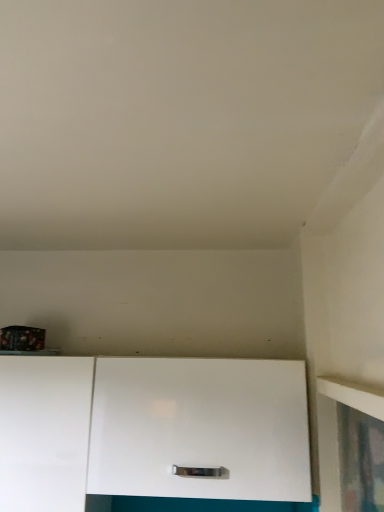
This screenshot has height=512, width=384. What do you see at coordinates (44, 432) in the screenshot? I see `white glossy cabinet at lower left, arranged as the first cabinetry when viewed from the left` at bounding box center [44, 432].

Image resolution: width=384 pixels, height=512 pixels. Find the location of `white glossy cabinet at lower left, arranged as the first cabinetry when viewed from the left`. white glossy cabinet at lower left, arranged as the first cabinetry when viewed from the left is located at coordinates (44, 432).

In order to face white glossy cabinet at lower left, the second cabinetry from the right, should I rotate leftwards or rightwards?

To face it directly, rotate left by 20.729 degrees.

What is the approximate width of white glossy cabinet at center, the 2th cabinetry from the left?

white glossy cabinet at center, the 2th cabinetry from the left, is 13.89 inches wide.

Describe the element at coordinates (152, 434) in the screenshot. I see `white glossy cabinet at center, the 2th cabinetry from the left` at that location.

Where is `white glossy cabinet at center, the 2th cabinetry from the left`? The image size is (384, 512). white glossy cabinet at center, the 2th cabinetry from the left is located at coordinates (152, 434).

This screenshot has height=512, width=384. What are the coordinates of `white glossy cabinet at lower left, the second cabinetry from the right` in the screenshot? It's located at (44, 432).

Considering the positions of objects white glossy cabinet at lower left, the second cabinetry from the right, and white glossy cabinet at center, placed as the 1th cabinetry when sorted from right to left, in the image provided, who is more to the left, white glossy cabinet at lower left, the second cabinetry from the right, or white glossy cabinet at center, placed as the 1th cabinetry when sorted from right to left,?

white glossy cabinet at lower left, the second cabinetry from the right.

Based on the photo, is the depth of white glossy cabinet at lower left, the second cabinetry from the right, greater than that of white glossy cabinet at center, the 2th cabinetry from the left?

Yes, white glossy cabinet at lower left, the second cabinetry from the right, is further from the viewer.

Considering the positions of points (58, 498) and (107, 384), is point (58, 498) farther from camera compared to point (107, 384)?

That is False.

From the image's perspective, between white glossy cabinet at lower left, arranged as the first cabinetry when viewed from the left, and white glossy cabinet at center, placed as the 1th cabinetry when sorted from right to left, which one is located above?

white glossy cabinet at center, placed as the 1th cabinetry when sorted from right to left, appears higher in the image.

From a real-world perspective, relative to white glossy cabinet at center, placed as the 1th cabinetry when sorted from right to left, is white glossy cabinet at lower left, the second cabinetry from the right, vertically above or below?

white glossy cabinet at lower left, the second cabinetry from the right, is situated lower than white glossy cabinet at center, placed as the 1th cabinetry when sorted from right to left, in the real world.

Between white glossy cabinet at lower left, arranged as the first cabinetry when viewed from the left, and white glossy cabinet at center, placed as the 1th cabinetry when sorted from right to left, which one has smaller width?

white glossy cabinet at lower left, arranged as the first cabinetry when viewed from the left.

From their relative heights in the image, would you say white glossy cabinet at lower left, arranged as the first cabinetry when viewed from the left, is taller or shorter than white glossy cabinet at center, the 2th cabinetry from the left?

Considering their sizes, white glossy cabinet at lower left, arranged as the first cabinetry when viewed from the left, has more height than white glossy cabinet at center, the 2th cabinetry from the left.

Can you confirm if white glossy cabinet at lower left, the second cabinetry from the right, is bigger than white glossy cabinet at center, placed as the 1th cabinetry when sorted from right to left?

Indeed, white glossy cabinet at lower left, the second cabinetry from the right, has a larger size compared to white glossy cabinet at center, placed as the 1th cabinetry when sorted from right to left.

Can we say white glossy cabinet at lower left, the second cabinetry from the right, lies outside white glossy cabinet at center, the 2th cabinetry from the left?

Yes.

Are white glossy cabinet at lower left, arranged as the first cabinetry when viewed from the left, and white glossy cabinet at center, placed as the 1th cabinetry when sorted from right to left, located far from each other?

No, there isn't a large distance between white glossy cabinet at lower left, arranged as the first cabinetry when viewed from the left, and white glossy cabinet at center, placed as the 1th cabinetry when sorted from right to left.

Does white glossy cabinet at lower left, the second cabinetry from the right, turn towards white glossy cabinet at center, placed as the 1th cabinetry when sorted from right to left?

No, white glossy cabinet at lower left, the second cabinetry from the right, is not oriented towards white glossy cabinet at center, placed as the 1th cabinetry when sorted from right to left.

How many degrees apart are the facing directions of white glossy cabinet at lower left, arranged as the first cabinetry when viewed from the left, and white glossy cabinet at center, placed as the 1th cabinetry when sorted from right to left?

The angular difference between white glossy cabinet at lower left, arranged as the first cabinetry when viewed from the left, and white glossy cabinet at center, placed as the 1th cabinetry when sorted from right to left, is 0.000278 degrees.

How much distance is there between white glossy cabinet at lower left, arranged as the first cabinetry when viewed from the left, and white glossy cabinet at center, the 2th cabinetry from the left?

white glossy cabinet at lower left, arranged as the first cabinetry when viewed from the left, is 10.37 centimeters away from white glossy cabinet at center, the 2th cabinetry from the left.

The image size is (384, 512). I want to click on cabinetry located above the white glossy cabinet at lower left, the second cabinetry from the right (from the image's perspective), so click(x=152, y=434).

Looking at this image, considering the relative positions of white glossy cabinet at center, the 2th cabinetry from the left, and white glossy cabinet at lower left, arranged as the first cabinetry when viewed from the left, in the image provided, is white glossy cabinet at center, the 2th cabinetry from the left, to the left or to the right of white glossy cabinet at lower left, arranged as the first cabinetry when viewed from the left,?

From the image, it's evident that white glossy cabinet at center, the 2th cabinetry from the left, is to the right of white glossy cabinet at lower left, arranged as the first cabinetry when viewed from the left.

Which object is more forward, white glossy cabinet at center, the 2th cabinetry from the left, or white glossy cabinet at lower left, the second cabinetry from the right?

white glossy cabinet at center, the 2th cabinetry from the left.

Is point (163, 429) positioned after point (65, 486)?

Yes, point (163, 429) is farther from viewer.

From the image's perspective, is white glossy cabinet at center, the 2th cabinetry from the left, located above white glossy cabinet at lower left, the second cabinetry from the right?

Yes, from the image's perspective, white glossy cabinet at center, the 2th cabinetry from the left, is over white glossy cabinet at lower left, the second cabinetry from the right.

From a real-world perspective, which object rests below the other?

In real-world perspective, white glossy cabinet at lower left, arranged as the first cabinetry when viewed from the left, is lower.

Which of these two, white glossy cabinet at center, the 2th cabinetry from the left, or white glossy cabinet at lower left, arranged as the first cabinetry when viewed from the left, is thinner?

With smaller width is white glossy cabinet at lower left, arranged as the first cabinetry when viewed from the left.

In the scene shown: Is white glossy cabinet at center, the 2th cabinetry from the left, shorter than white glossy cabinet at lower left, the second cabinetry from the right?

Correct, white glossy cabinet at center, the 2th cabinetry from the left, is not as tall as white glossy cabinet at lower left, the second cabinetry from the right.

Is white glossy cabinet at center, the 2th cabinetry from the left, bigger than white glossy cabinet at lower left, arranged as the first cabinetry when viewed from the left?

Actually, white glossy cabinet at center, the 2th cabinetry from the left, might be smaller than white glossy cabinet at lower left, arranged as the first cabinetry when viewed from the left.

Is white glossy cabinet at lower left, arranged as the first cabinetry when viewed from the left, inside white glossy cabinet at center, placed as the 1th cabinetry when sorted from right to left?

Definitely not — white glossy cabinet at lower left, arranged as the first cabinetry when viewed from the left, is not inside white glossy cabinet at center, placed as the 1th cabinetry when sorted from right to left.

Are white glossy cabinet at center, the 2th cabinetry from the left, and white glossy cabinet at lower left, arranged as the first cabinetry when viewed from the left, making contact?

No, white glossy cabinet at center, the 2th cabinetry from the left, is not in contact with white glossy cabinet at lower left, arranged as the first cabinetry when viewed from the left.

Does white glossy cabinet at center, the 2th cabinetry from the left, turn towards white glossy cabinet at lower left, the second cabinetry from the right?

No, white glossy cabinet at center, the 2th cabinetry from the left, is not oriented towards white glossy cabinet at lower left, the second cabinetry from the right.

The width and height of the screenshot is (384, 512). In order to click on cabinetry on the right of white glossy cabinet at lower left, arranged as the first cabinetry when viewed from the left in this screenshot , I will do `click(152, 434)`.

Locate an element on the screen. cabinetry on the left side of white glossy cabinet at center, placed as the 1th cabinetry when sorted from right to left is located at coordinates pyautogui.click(x=44, y=432).

The image size is (384, 512). What are the coordinates of `cabinetry above the white glossy cabinet at lower left, the second cabinetry from the right (from a real-world perspective)` in the screenshot? It's located at (152, 434).